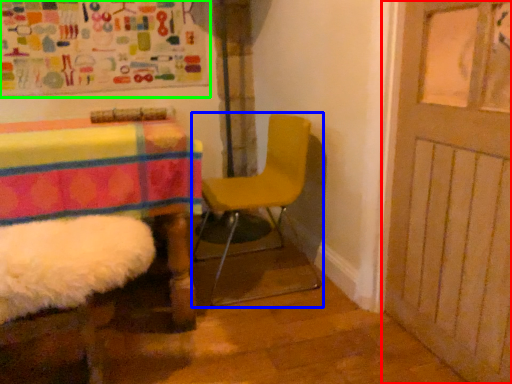
Question: Which object is positioned farthest from door (highlighted by a red box)? Select from chair (highlighted by a blue box) and bulletin board (highlighted by a green box).

Choices:
 (A) chair
 (B) bulletin board

Answer: (B)